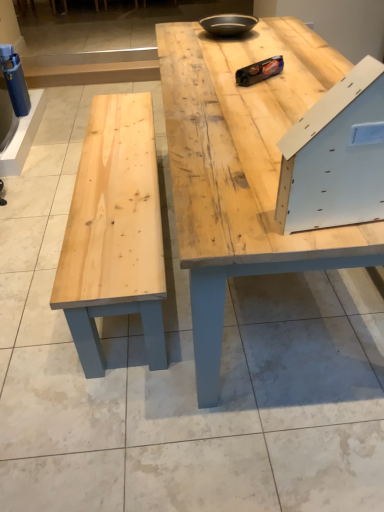
Question: In the image, is matte black bowl at upper center positioned in front of or behind natural wood table at center?

Choices:
 (A) front
 (B) behind

Answer: (B)

Question: From a real-world perspective, is matte black bowl at upper center above or below natural wood table at center?

Choices:
 (A) above
 (B) below

Answer: (A)

Question: Which of these objects is positioned closest to the natural wood table at center?

Choices:
 (A) matte black bowl at upper center
 (B) white matte drawer at upper right

Answer: (B)

Question: Which of these objects is positioned closest to the natural wood table at center?

Choices:
 (A) white matte drawer at upper right
 (B) matte black bowl at upper center

Answer: (A)